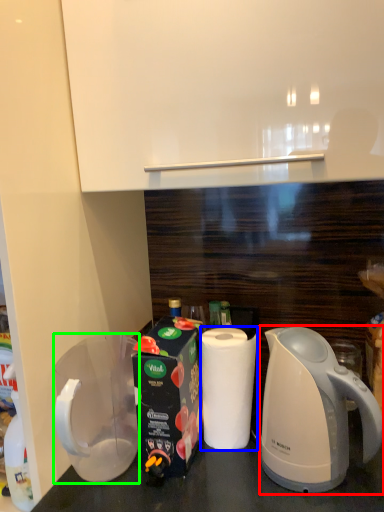
Question: Which object is positioned farthest from kettle (highlighted by a red box)? Select from paper towel (highlighted by a blue box) and pitcher (highlighted by a green box).

Choices:
 (A) paper towel
 (B) pitcher

Answer: (B)